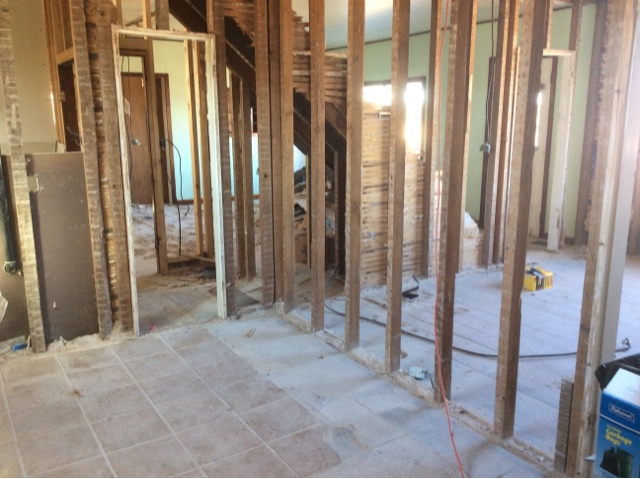
Image resolution: width=640 pixels, height=479 pixels. Identify the location of wood staircase. (301, 60), (367, 132), (411, 178).